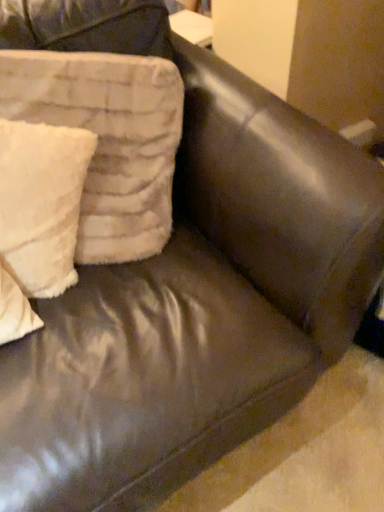
Question: From the image's perspective, is white fuzzy pillow at left, which is the 2th pillow from left to right, positioned above or below white fluffy pillow at left, placed as the 1th pillow when sorted from left to right?

Choices:
 (A) above
 (B) below

Answer: (A)

Question: Relative to white fluffy pillow at left, which ranks as the 2th pillow in right-to-left order, is white fuzzy pillow at left, which is the 2th pillow from left to right, in front or behind?

Choices:
 (A) front
 (B) behind

Answer: (A)

Question: Is white fuzzy pillow at left, marked as the first pillow in a right-to-left arrangement, spatially inside white fluffy pillow at left, placed as the 1th pillow when sorted from left to right, or outside of it?

Choices:
 (A) outside
 (B) inside

Answer: (A)

Question: From the image's perspective, is white fluffy pillow at left, which ranks as the 2th pillow in right-to-left order, located above or below white fuzzy pillow at left, marked as the first pillow in a right-to-left arrangement?

Choices:
 (A) above
 (B) below

Answer: (B)

Question: From a real-world perspective, is white fluffy pillow at left, placed as the 1th pillow when sorted from left to right, above or below white fuzzy pillow at left, which is the 2th pillow from left to right?

Choices:
 (A) below
 (B) above

Answer: (A)

Question: From their relative heights in the image, would you say white fluffy pillow at left, placed as the 1th pillow when sorted from left to right, is taller or shorter than white fuzzy pillow at left, marked as the first pillow in a right-to-left arrangement?

Choices:
 (A) tall
 (B) short

Answer: (B)

Question: Does point (41, 131) appear closer or farther from the camera than point (89, 252)?

Choices:
 (A) closer
 (B) farther

Answer: (A)